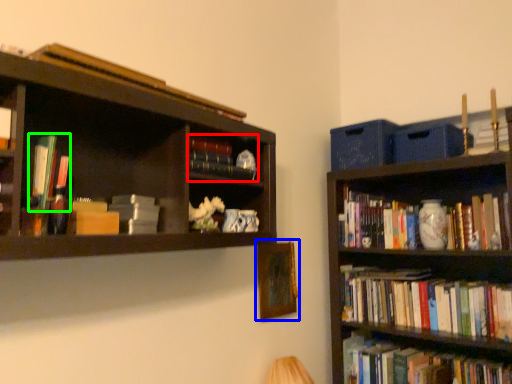
Question: Estimate the real-world distances between objects in this image. Which object is farther from book (highlighted by a red box), picture frame (highlighted by a blue box) or book (highlighted by a green box)?

Choices:
 (A) picture frame
 (B) book

Answer: (A)